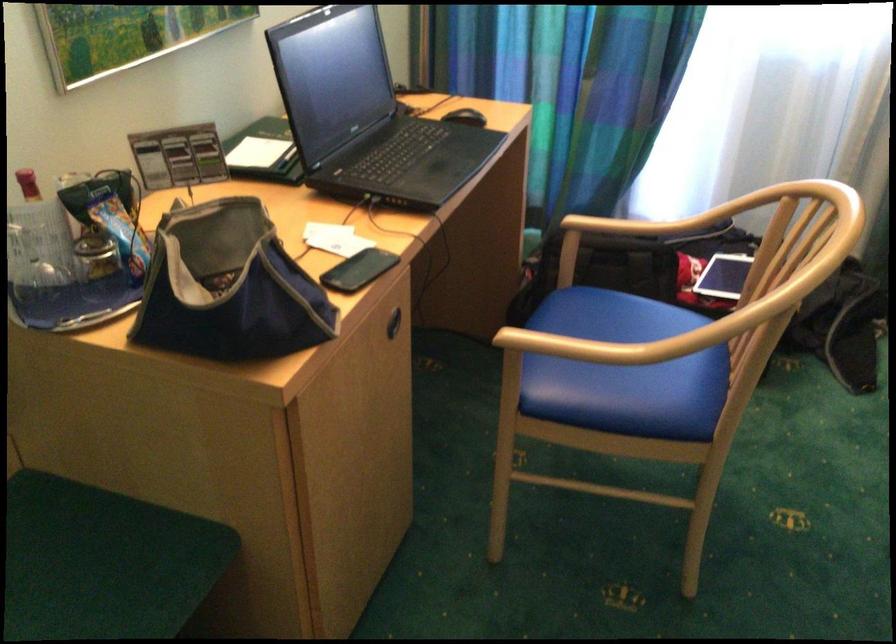
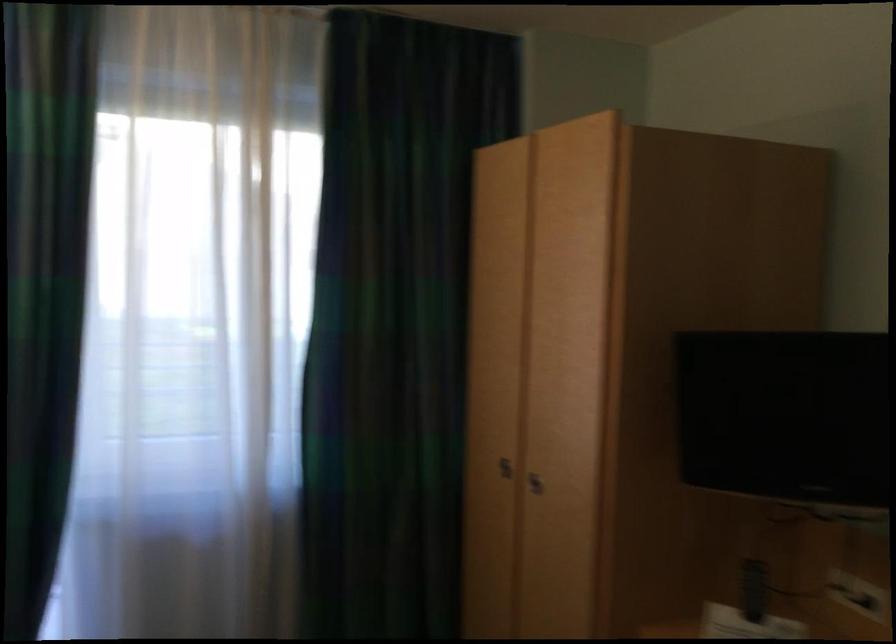
The first image is from the beginning of the video and the second image is from the end. How did the camera likely rotate when shooting the video?

The camera's rotation is toward right-up.